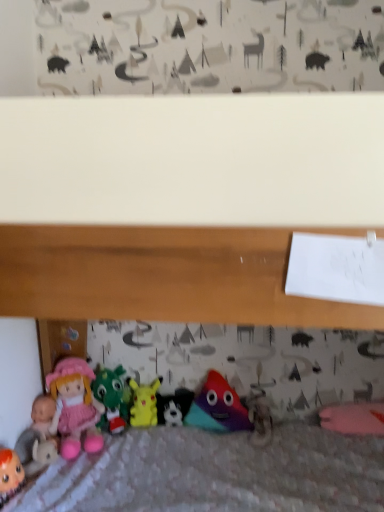
Question: Is point (102, 402) positioned closer to the camera than point (172, 413)?

Choices:
 (A) farther
 (B) closer

Answer: (A)

Question: Is velvety green dragon at center, the 2th toy when ordered from left to right, taller or shorter than black plush toy at center, arranged as the fourth toy when viewed from the left?

Choices:
 (A) short
 (B) tall

Answer: (B)

Question: Which object is the closest to the matte pink doll at lower left, which ranks as the 5th toy in right-to-left order?

Choices:
 (A) yellow matte pikachu at center, acting as the 3th toy starting from the right
 (B) black plush toy at center, arranged as the fourth toy when viewed from the left
 (C) velvety green dragon at center, the 2th toy when ordered from left to right
 (D) matte plastic toy at center, the fifth toy when ordered from left to right
 (E) matte pink fabric doll at lower left

Answer: (E)

Question: Which object is the closest to the black plush toy at center, arranged as the fourth toy when viewed from the left?

Choices:
 (A) matte plastic toy at center, which appears as the first toy when viewed from the right
 (B) yellow matte pikachu at center, the 3th toy positioned from the left
 (C) velvety green dragon at center, which appears as the fourth toy when viewed from the right
 (D) matte pink fabric doll at lower left
 (E) matte pink doll at lower left, which ranks as the 5th toy in right-to-left order

Answer: (B)